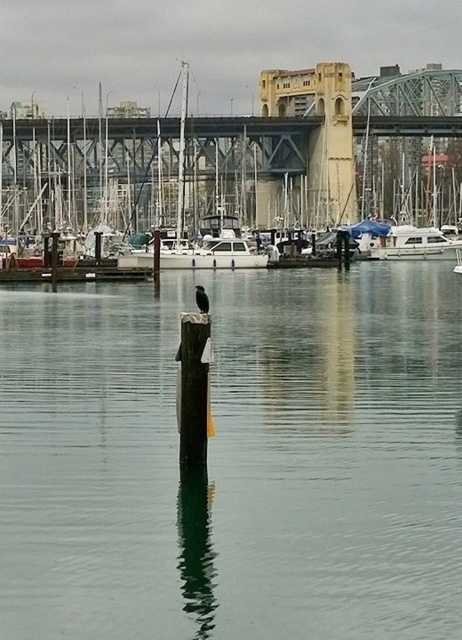
You are standing on the wooden dock at center and want to walk to the white glossy boat at right. Which direction should you face to move towards the boat?

You should face to the right because the white glossy boat at right is to the right of the wooden dock at center.

Based on the photo, you are a photographer planning to take a photo of the green wood post at center and the wooden dock at center in the marina scene. Based on their sizes, which object should you focus on to ensure it fills the frame adequately without cropping?

The green wood post at center is bigger than the wooden dock at center, so focusing on the green wood post at center would ensure it fills the frame adequately without cropping.

You are standing at the edge of the marina and want to reach a specific point in the water marked at point (212,582). Your boat can travel a maximum distance of 15 meters before needing to refuel. Can you reach the point without refueling?

The distance between point (212,582) and the viewer is 16.97 meters, which exceeds the boat maximum travel distance of 15 meters. Therefore, you cannot reach the point without refueling.